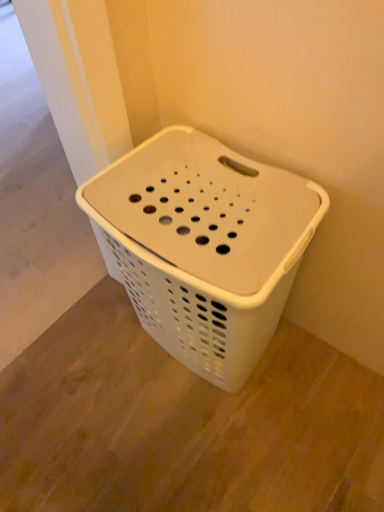
The width and height of the screenshot is (384, 512). In order to click on vacant area to the left of white plastic laundry basket at center in this screenshot , I will do `click(92, 381)`.